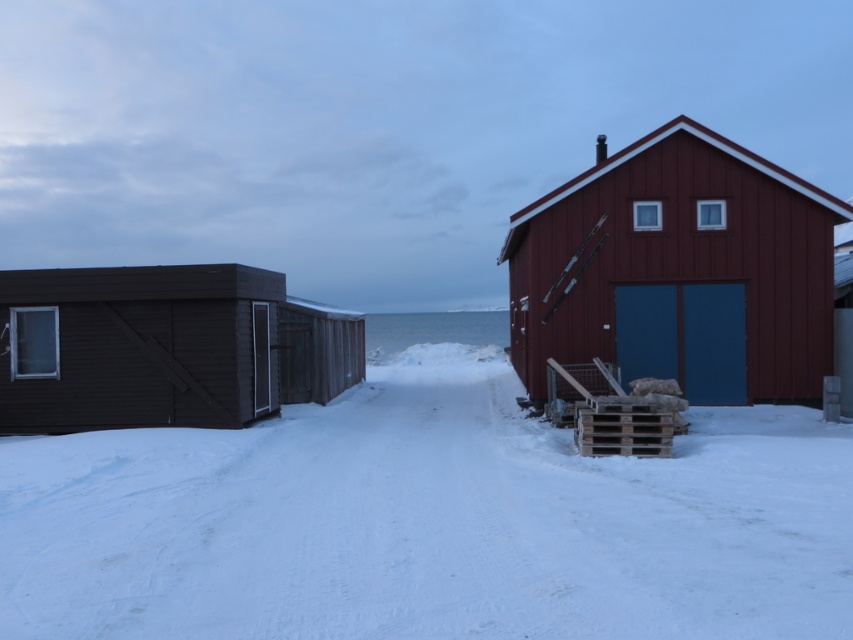
Locate an element on the screen. white powdery snow at center is located at coordinates pos(428,522).

Does white powdery snow at center have a greater height compared to matte red barn at right?

In fact, white powdery snow at center may be shorter than matte red barn at right.

Measure the distance between white powdery snow at center and camera.

white powdery snow at center is 16.40 feet from camera.

Locate an element on the screen. This screenshot has width=853, height=640. white powdery snow at center is located at coordinates (428, 522).

Which is more to the right, matte red barn at right or dark brown wood cabin at left?

matte red barn at right is more to the right.

Is matte red barn at right above dark brown wood cabin at left?

Yes.

This screenshot has height=640, width=853. What do you see at coordinates (677, 272) in the screenshot?
I see `matte red barn at right` at bounding box center [677, 272].

This screenshot has height=640, width=853. Find the location of `matte red barn at right`. matte red barn at right is located at coordinates coord(677,272).

Is white powdery snow at center thinner than dark brown wood cabin at left?

No, white powdery snow at center is not thinner than dark brown wood cabin at left.

Measure the distance between white powdery snow at center and camera.

white powdery snow at center and camera are 5.00 meters apart.

Describe the element at coordinates (428, 522) in the screenshot. I see `white powdery snow at center` at that location.

Where is `white powdery snow at center`? This screenshot has height=640, width=853. white powdery snow at center is located at coordinates coord(428,522).